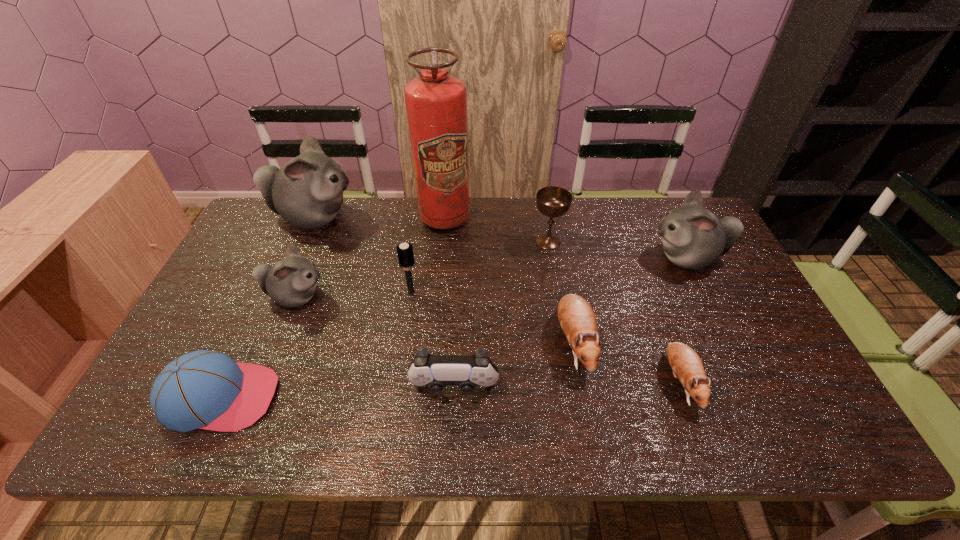
Locate an element on the screen. The image size is (960, 540). free space located 0.190m on the face of the eighth shortest object is located at coordinates (587, 258).

At what (x,y) coordinates should I click in order to perform the action: click on vacant point located 0.280m on the right of the chalice. Please return your answer as a coordinate pair (x, y). Image resolution: width=960 pixels, height=540 pixels. Looking at the image, I should click on (652, 241).

The image size is (960, 540). I want to click on free location located 0.190m on the back of the hairbrush, so click(x=419, y=244).

What are the coordinates of `vacant space located 0.150m on the face of the smallest white hamster` in the screenshot? It's located at (380, 297).

You are a GUI agent. You are given a task and a screenshot of the screen. Output one action in this format:
    pyautogui.click(x=<x>, y=<y>)
    Task: Click on the vacant position located on the front-facing side of the control
    This screenshot has width=960, height=540.
    Given the screenshot: What is the action you would take?
    pyautogui.click(x=452, y=441)

Locate an element on the screen. Image resolution: width=960 pixels, height=540 pixels. vacant point located at the face of the third hamster from right to left is located at coordinates [588, 414].

Where is `free region located 0.380m on the front-facing side of the blue baseball cap`? The width and height of the screenshot is (960, 540). free region located 0.380m on the front-facing side of the blue baseball cap is located at coordinates (440, 397).

Locate an element on the screen. This screenshot has width=960, height=540. fire extinguisher that is positioned at the far edge is located at coordinates (436, 103).

Locate an element on the screen. The width and height of the screenshot is (960, 540). chalice that is at the far edge is located at coordinates (552, 201).

The height and width of the screenshot is (540, 960). What are the coordinates of `control present at the near edge` in the screenshot? It's located at (437, 371).